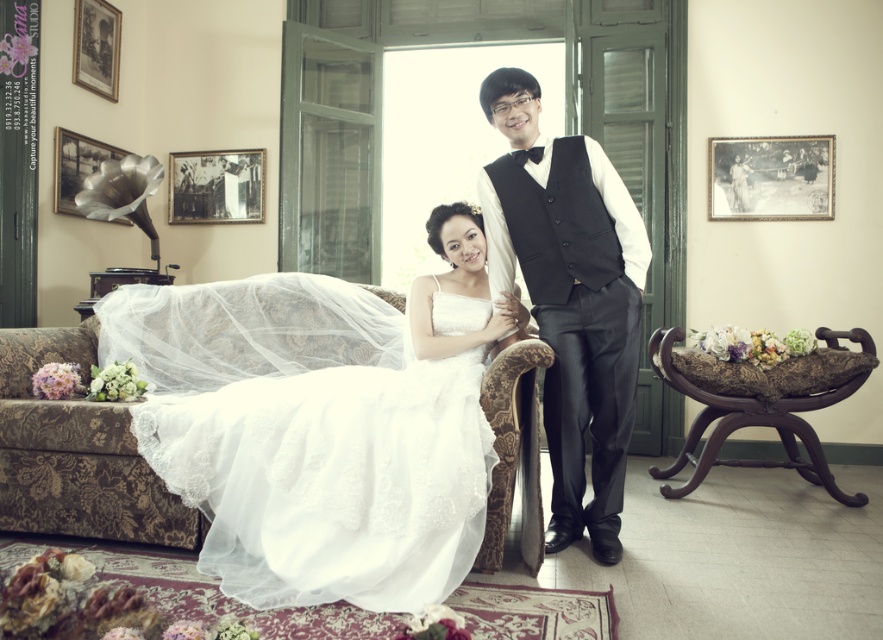
You are a photographer setting up for a wedding photo shoot. You need to position a light source to the left of the white lace dress at center and to the right of the brown wood armchair at right. Is this possible based on their current positions?

The white lace dress at center is to the left of the brown wood armchair at right, so placing a light source to the left of the white lace dress at center would also be to the left of the brown wood armchair at right. Therefore, it is not possible to position the light source both to the left of the white lace dress at center and to the right of the brown wood armchair at right simultaneously.

You are a photographer positioned in front of the bride. You notice the white lace dress at center and the black satin vest at center. Which one do you see first when looking directly at the bride?

The white lace dress at center is closer to the viewer than the black satin vest at center, so you would see the white lace dress at center first when looking directly at the bride.